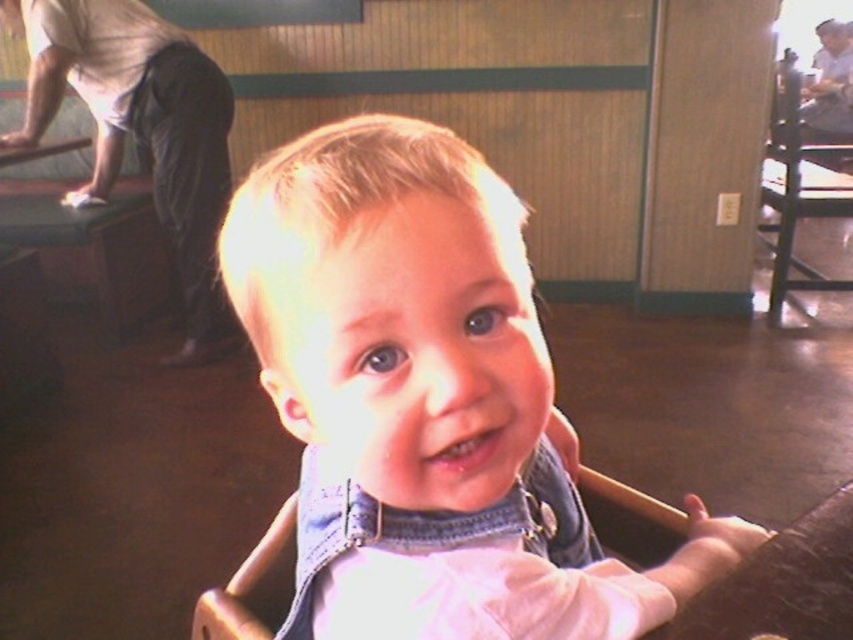
Is point (183, 115) closer to viewer compared to point (776, 276)?

Yes, it is.

At what (x,y) coordinates should I click in order to perform the action: click on white matte baby at upper center. Please return your answer as a coordinate pair (x, y). The image size is (853, 640). Looking at the image, I should click on (141, 131).

You are a GUI agent. You are given a task and a screenshot of the screen. Output one action in this format:
    pyautogui.click(x=<x>, y=<y>)
    Task: Click on the white matte baby at upper center
    This screenshot has height=640, width=853.
    Given the screenshot: What is the action you would take?
    pyautogui.click(x=141, y=131)

Is denim overalls at center shorter than black wood chair at right?

Correct, denim overalls at center is not as tall as black wood chair at right.

Between denim overalls at center and black wood chair at right, which one is positioned higher?

black wood chair at right is higher up.

Who is more forward, [329,193] or [816,289]?

Point [329,193] is more forward.

Identify the location of denim overalls at center. The height and width of the screenshot is (640, 853). (426, 401).

Does denim overalls at center appear on the left side of white matte baby at upper center?

Incorrect, denim overalls at center is not on the left side of white matte baby at upper center.

Does point (306, 145) come closer to viewer compared to point (132, 52)?

Yes, point (306, 145) is closer to viewer.

This screenshot has height=640, width=853. Identify the location of denim overalls at center. (426, 401).